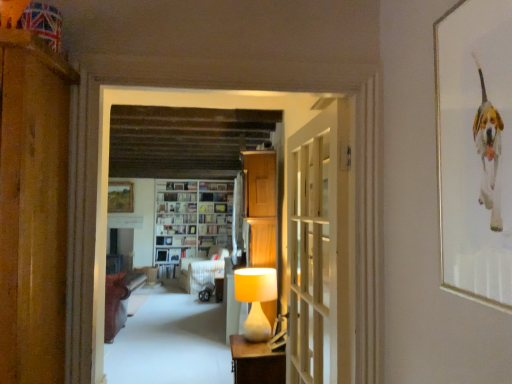
Question: Is point (215, 256) closer or farther from the camera than point (243, 198)?

Choices:
 (A) closer
 (B) farther

Answer: (B)

Question: Relative to white fabric curtain at center, is white fabric sofa at center, the 1th furniture when ordered from back to front, in front or behind?

Choices:
 (A) front
 (B) behind

Answer: (B)

Question: Which object is the farthest from the hardcover book at center, marked as the 1th book in a bottom-to-top arrangement?

Choices:
 (A) matte brown wooden table at lower center, the 3th furniture from the back
 (B) metallic gold picture frame at upper right, which is counted as the 2th picture frame, starting from the back
 (C) matte cream lampshade at center
 (D) wooden cabinet at center
 (E) brown leather sofa at left, placed as the second furniture when sorted from back to front

Answer: (B)

Question: Based on their relative distances, which object is farther from the wooden picture frame at upper center, positioned as the 1th picture frame in left-to-right order?

Choices:
 (A) white fabric sofa at center, placed as the third furniture when sorted from front to back
 (B) white fabric curtain at center
 (C) white wooden door at center
 (D) hardcover book at center, placed as the fifth book when sorted from bottom to top
 (E) white glossy bookshelf at center

Answer: (C)